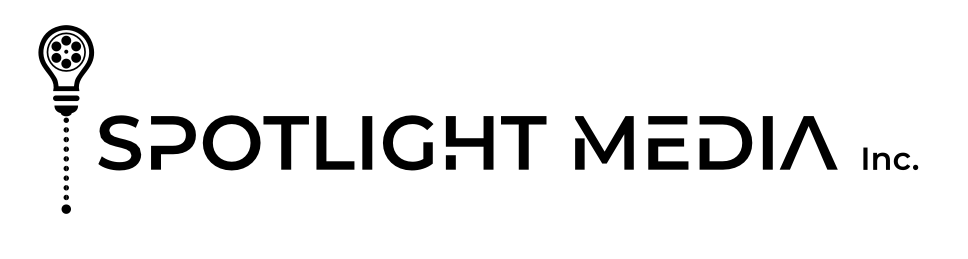
The image size is (968, 259). Identify the location of lightbulb. (68, 79).